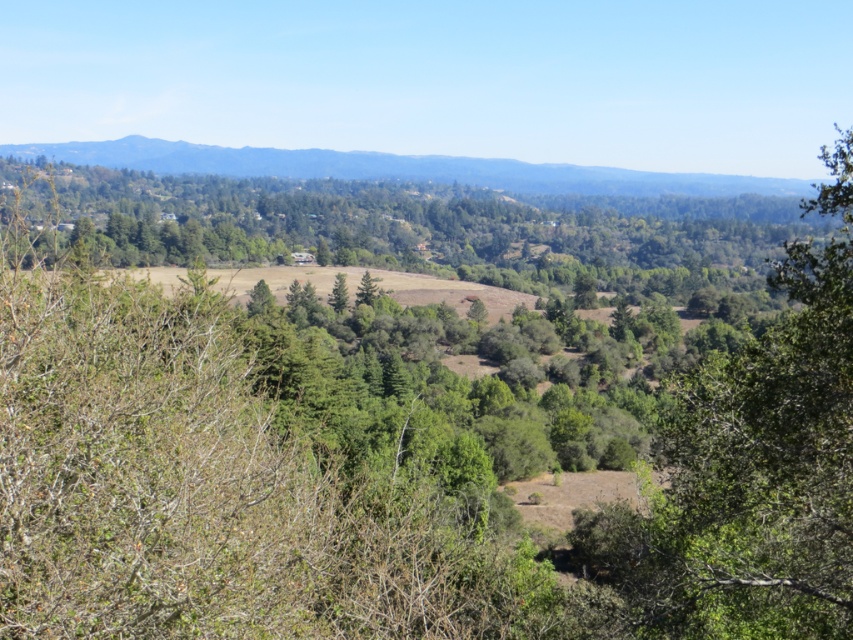
Is green leafy tree at center thinner than green forested mountain at upper center?

Correct, green leafy tree at center's width is less than green forested mountain at upper center's.

Between green leafy tree at center and green forested mountain at upper center, which one appears on the right side from the viewer's perspective?

green leafy tree at center is more to the right.

Identify the location of green leafy tree at center. The height and width of the screenshot is (640, 853). click(410, 228).